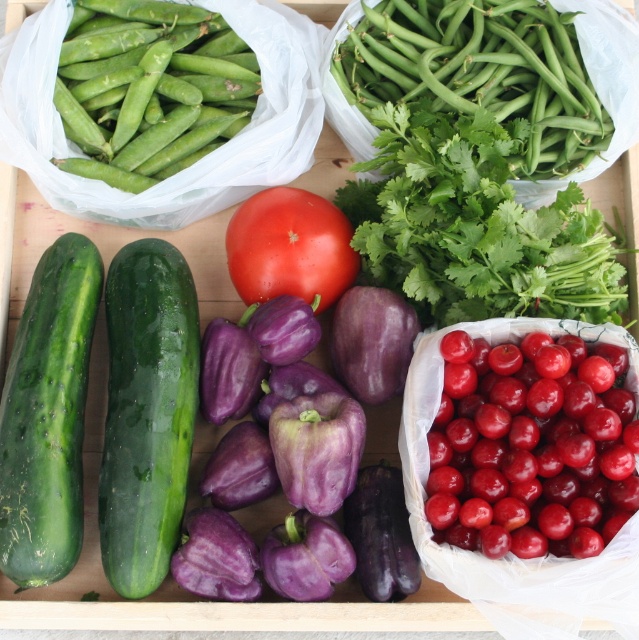
Question: Observing the image, what is the correct spatial positioning of green matte pod at upper left in reference to green smooth skin cucumber at left?

Choices:
 (A) right
 (B) left

Answer: (A)

Question: Does green smooth cucumber at left appear under red matte tomato at center?

Choices:
 (A) no
 (B) yes

Answer: (B)

Question: Which point appears farthest from the camera in this image?

Choices:
 (A) (42, 381)
 (B) (401, 16)
 (C) (167, 531)
 (D) (350, 493)

Answer: (B)

Question: Is green smooth skin cucumber at left further to the viewer compared to purple matte eggplant at center?

Choices:
 (A) no
 (B) yes

Answer: (A)

Question: Which point appears farthest from the camera in this image?

Choices:
 (A) (454, 448)
 (B) (401, 545)
 (C) (155, 90)
 (D) (128, 380)

Answer: (C)

Question: Which of the following is the farthest from the observer?

Choices:
 (A) (235, 285)
 (B) (75, 358)
 (C) (158, 584)
 (D) (190, 138)

Answer: (A)